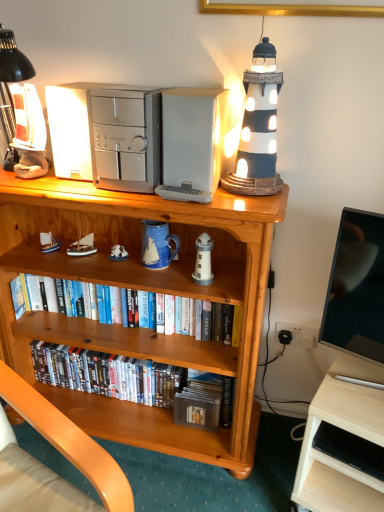
Locate an element on the screen. Image resolution: width=384 pixels, height=512 pixels. vacant region in front of matte black lighthouse at upper right is located at coordinates (249, 200).